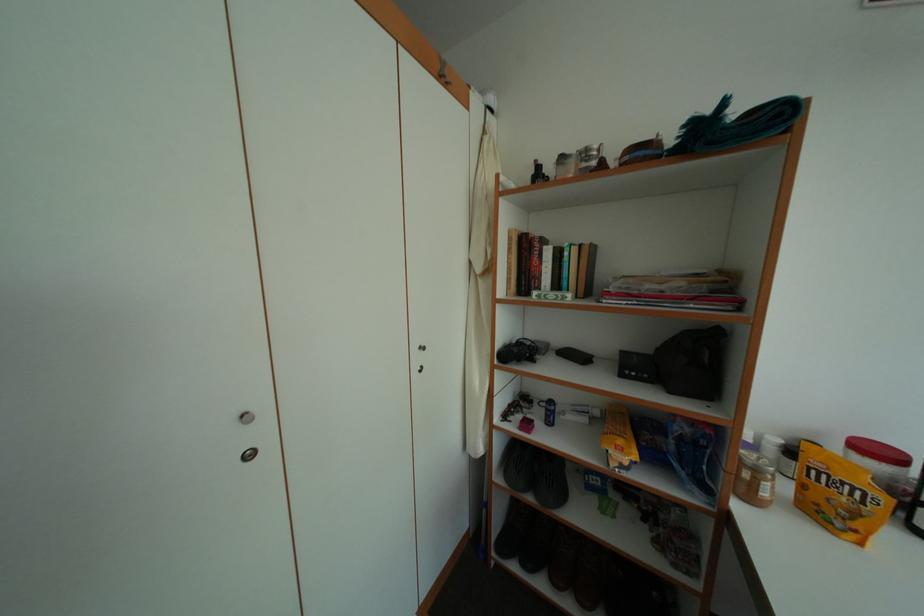
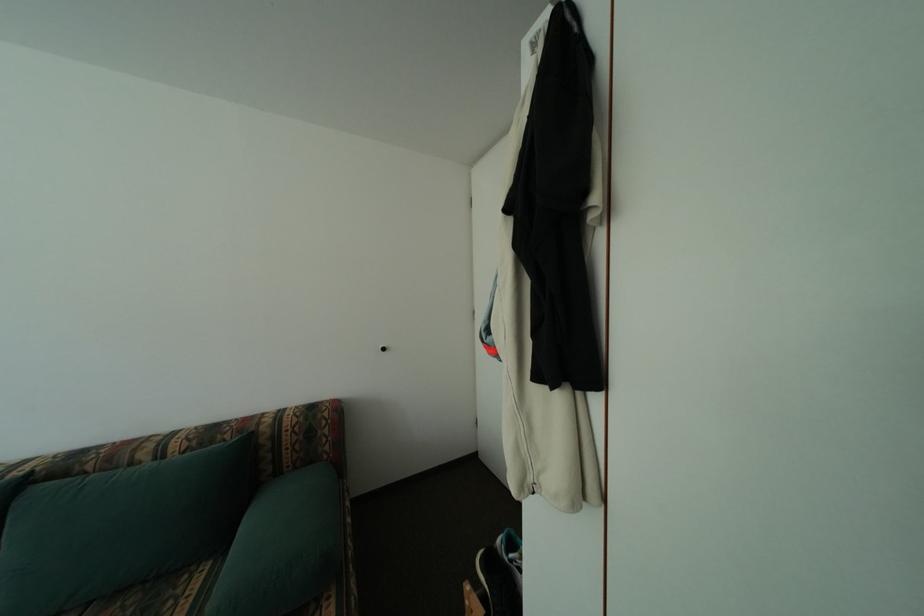
Question: The camera is either moving clockwise (left) or counter-clockwise (right) around the object. The first image is from the beginning of the video and the second image is from the end. Is the camera moving left or right when shooting the video?

Choices:
 (A) Left
 (B) Right

Answer: (B)